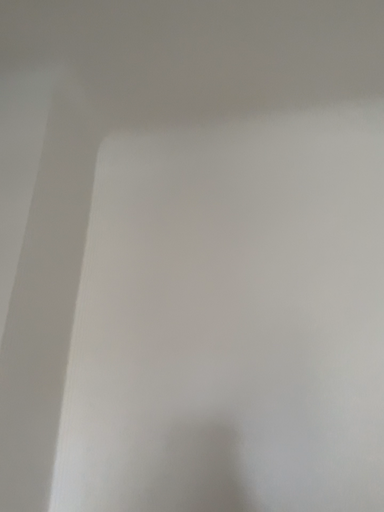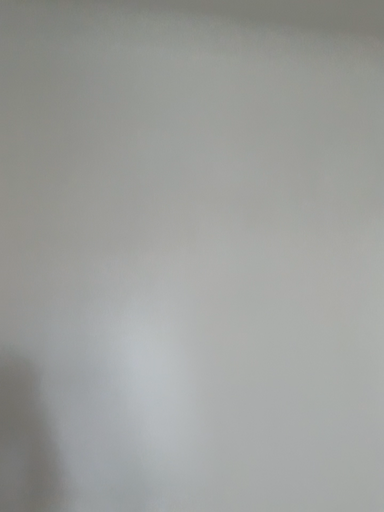
Question: How did the camera likely rotate when shooting the video?

Choices:
 (A) rotated downward
 (B) rotated upward

Answer: (A)